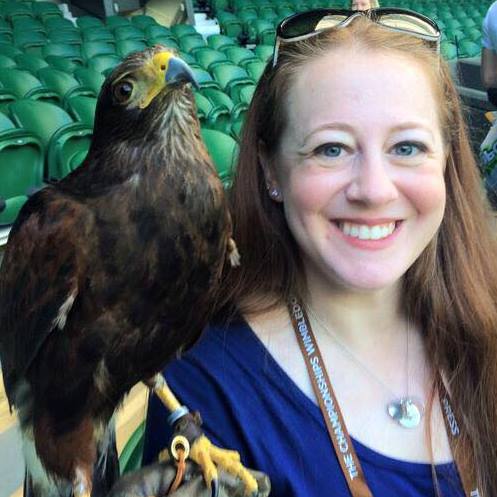
Locate an element on the screen. This screenshot has height=497, width=497. green seats is located at coordinates (64, 62), (460, 15).